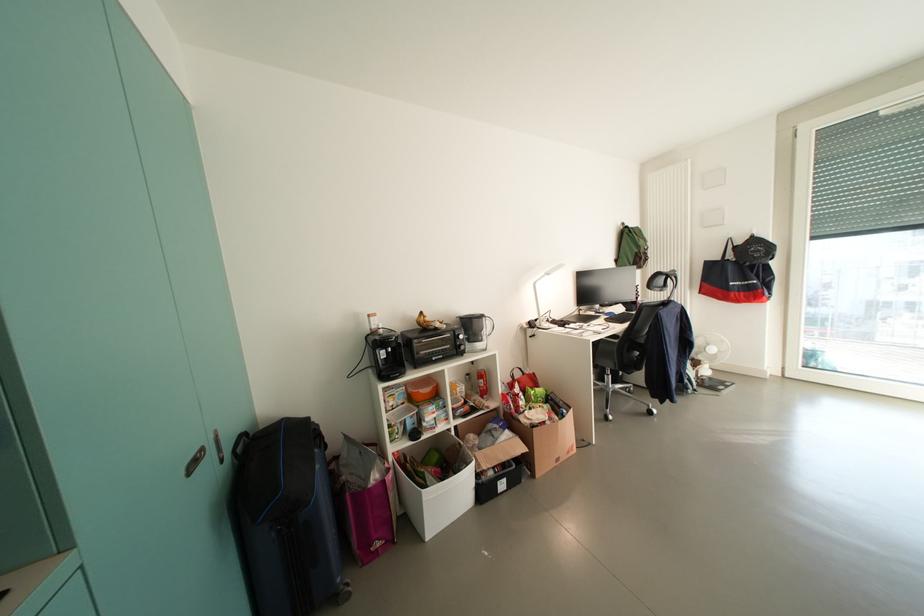
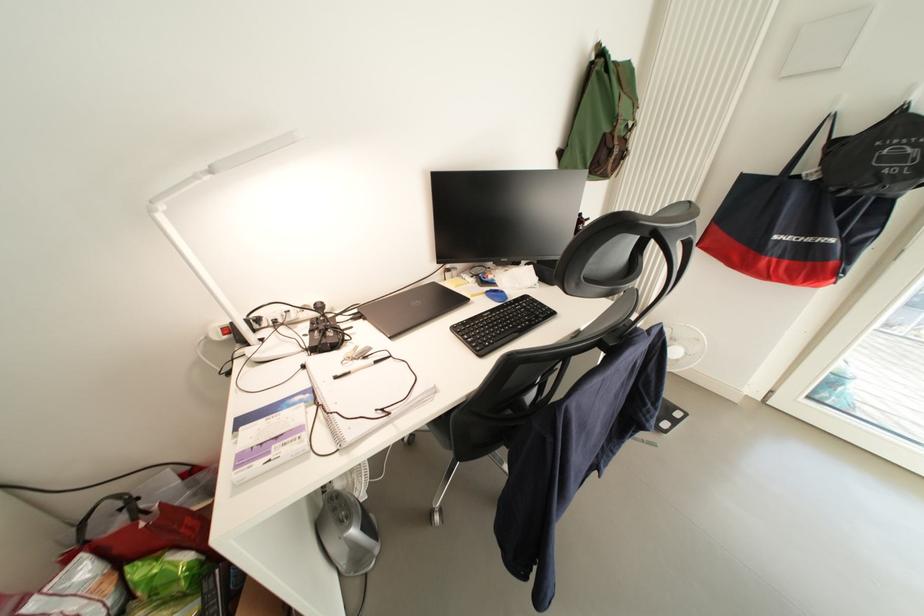
Find the pixel in the second image that matches pixel 624 264 in the first image.

(568, 156)